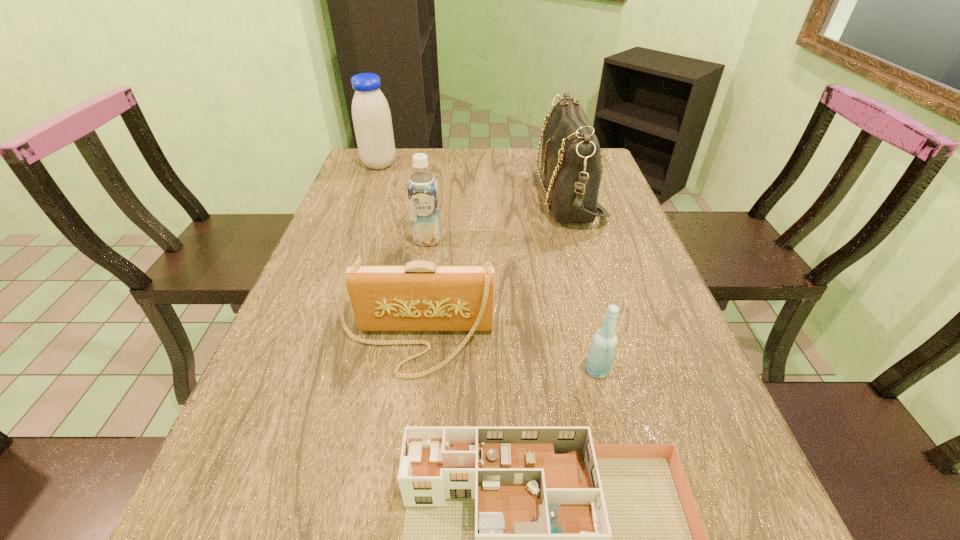
What are the coordinates of `object that stands as the third closest to the nearer soya milk` in the screenshot? It's located at (371, 115).

I want to click on vacant point that satisfies the following two spatial constraints: 1. on the decorative side of the bottle; 2. on the right side of the left handbag, so click(x=412, y=370).

Identify the location of vacant position in the image that satisfies the following two spatial constraints: 1. on the decorative side of the left handbag; 2. on the left side of the bottle. This screenshot has height=540, width=960. tap(412, 370).

Find the location of a particular element. Image resolution: width=960 pixels, height=540 pixels. vacant space that satisfies the following two spatial constraints: 1. at the front of the right handbag with chain and zipper; 2. on the front side of the bottle is located at coordinates (619, 370).

This screenshot has width=960, height=540. Identify the location of free location that satisfies the following two spatial constraints: 1. on the front side of the taller soya milk; 2. on the right side of the bottle. (303, 370).